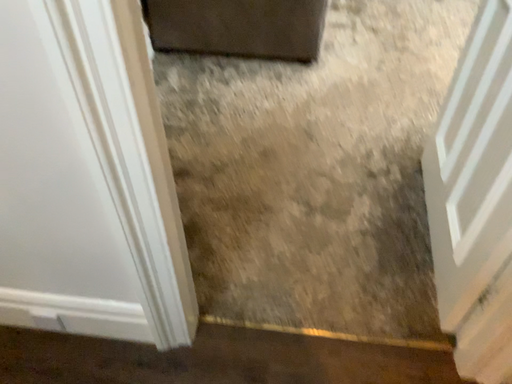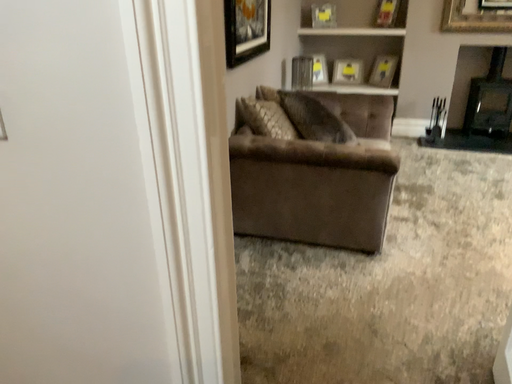
Question: Which way did the camera rotate in the video?

Choices:
 (A) rotated downward
 (B) rotated upward

Answer: (B)